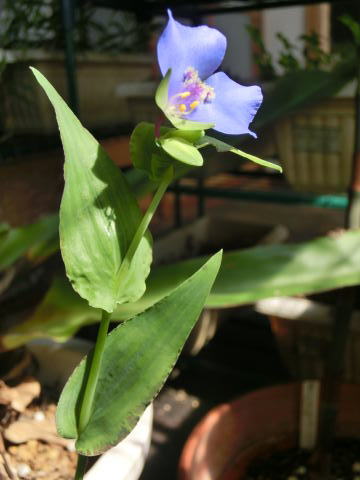
Locate an element on the screen. terracotta pot is located at coordinates point(205,433).